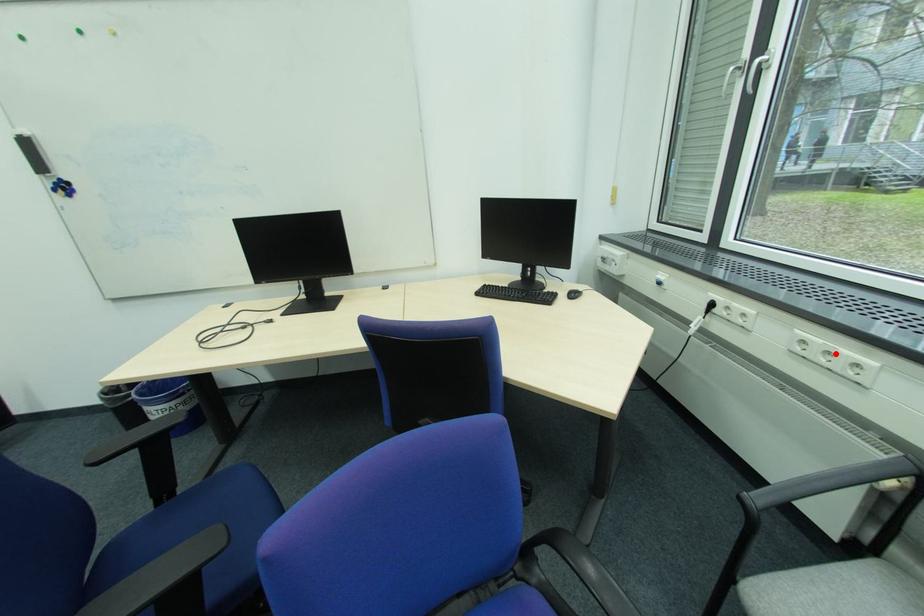
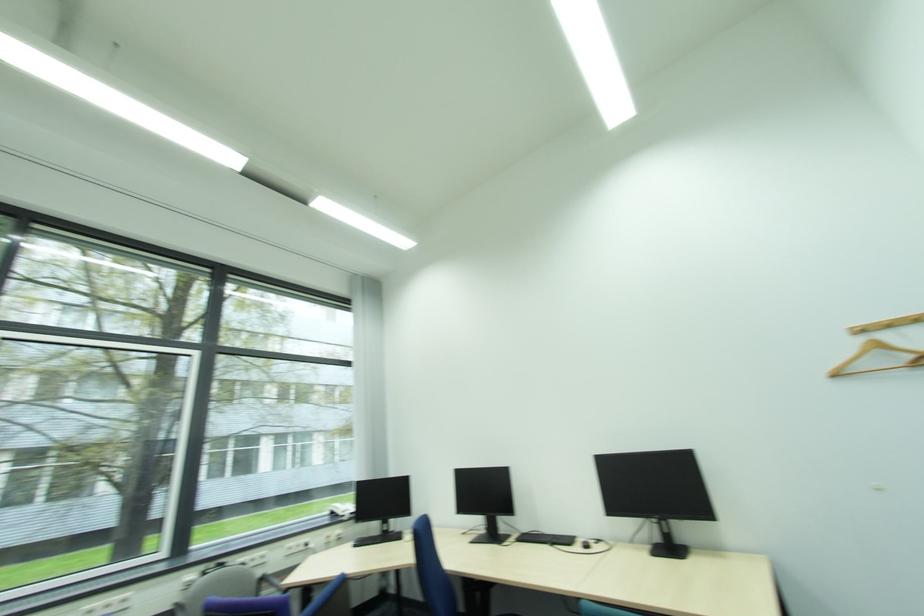
Where in the second image is the point corresponding to the highlighted location from the first image?

(114, 607)